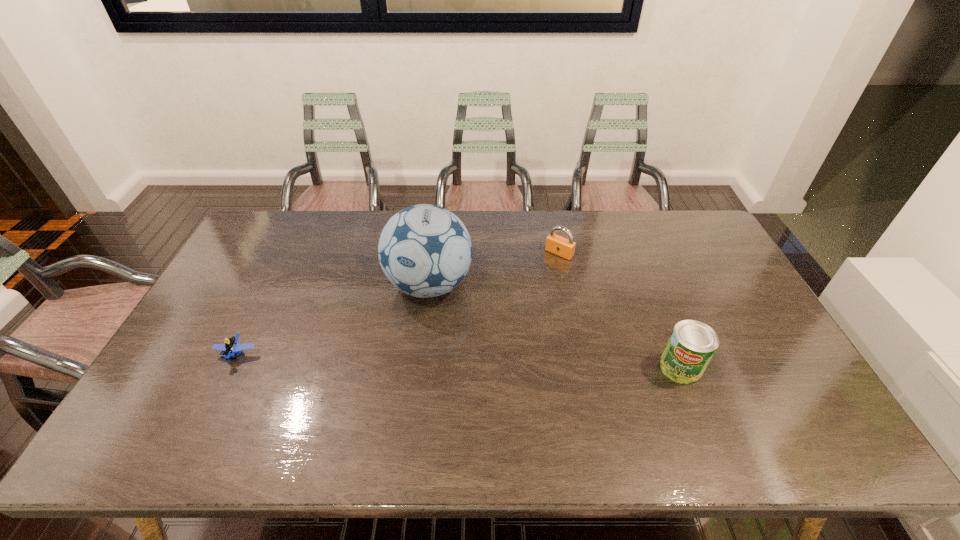
Image resolution: width=960 pixels, height=540 pixels. I want to click on free space located to unlock the second object from right to left from the front, so click(x=530, y=284).

Identify the location of blank space located 0.170m to unlock the second object from right to left from the front. (526, 288).

The width and height of the screenshot is (960, 540). I want to click on free location located to unlock the second object from right to left from the front, so click(x=496, y=321).

The width and height of the screenshot is (960, 540). I want to click on vacant space situated on the side with brand of the soccer ball, so click(x=415, y=345).

Identify the location of vacant space located 0.170m on the side with brand of the soccer ball. (410, 365).

Image resolution: width=960 pixels, height=540 pixels. Find the location of `vacant space situated 0.100m on the side with brand of the soccer ball`. vacant space situated 0.100m on the side with brand of the soccer ball is located at coordinates (415, 345).

Locate an element on the screen. This screenshot has width=960, height=540. object at the far edge is located at coordinates (563, 247).

You are a GUI agent. You are given a task and a screenshot of the screen. Output one action in this format:
    pyautogui.click(x=<x>, y=<y>)
    Task: Click on the object at the near edge
    The image size is (960, 540).
    Given the screenshot: What is the action you would take?
    pyautogui.click(x=692, y=344)

Find the location of a particular element. The image size is (960, 540). object that is at the left edge is located at coordinates (231, 346).

Find the location of `vacant space at the far edge of the desktop`. vacant space at the far edge of the desktop is located at coordinates (308, 241).